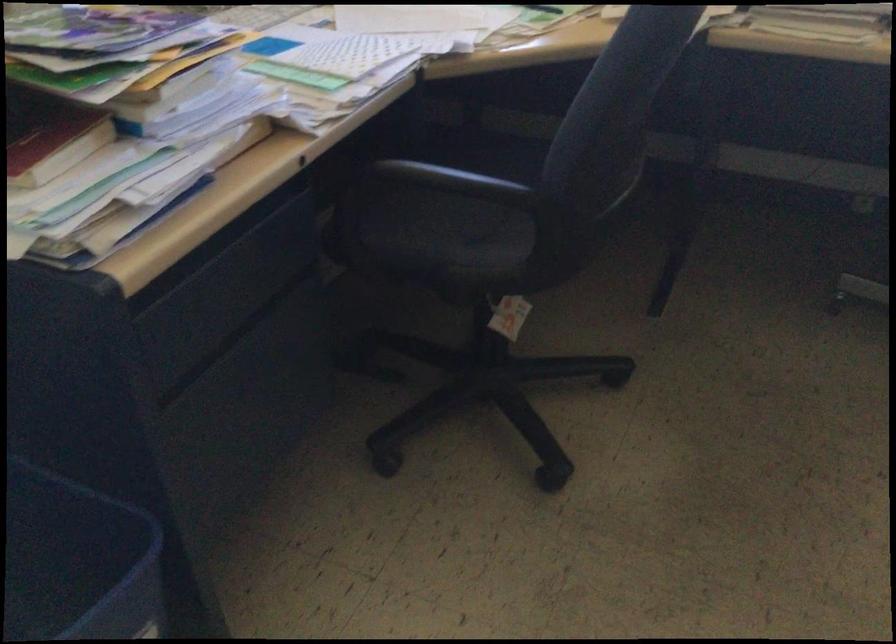
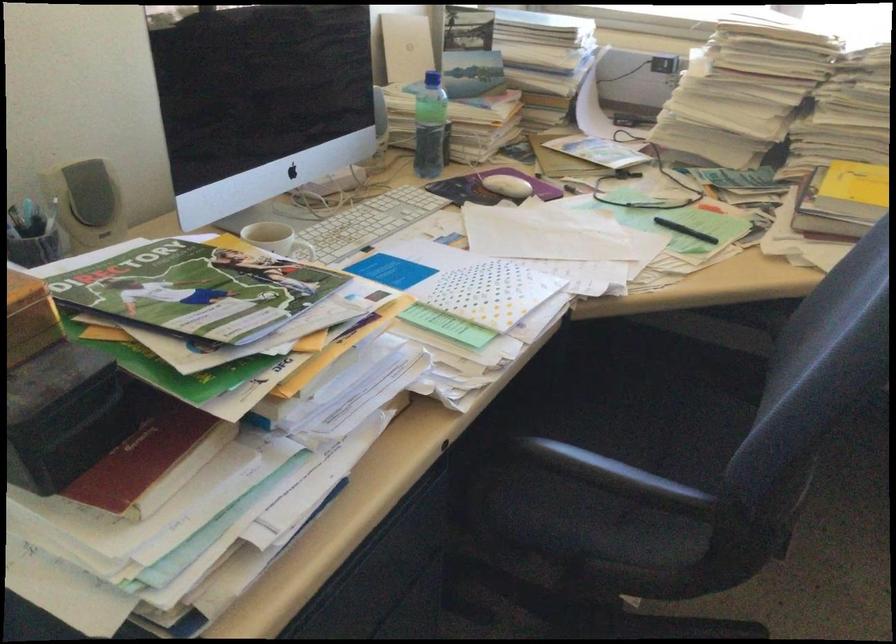
Question: Based on the continuous images, in which direction is the camera rotating? Reply with the corresponding letter.

Choices:
 (A) Left
 (B) Right
 (C) Up
 (D) Down

Answer: (C)